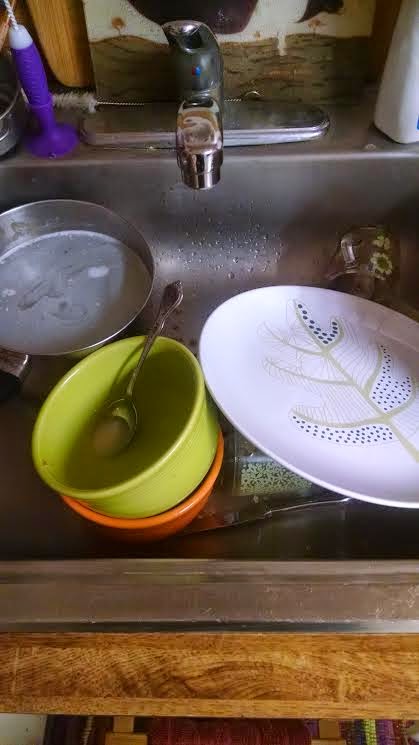
Identify the location of flower design on glass. Image resolution: width=419 pixels, height=745 pixels. (384, 261), (382, 241).